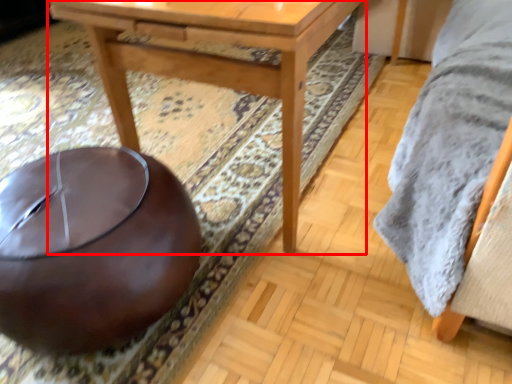
Question: Observing the image, what is the correct spatial positioning of table (annotated by the red box) in reference to bean bag chair?

Choices:
 (A) right
 (B) left

Answer: (A)